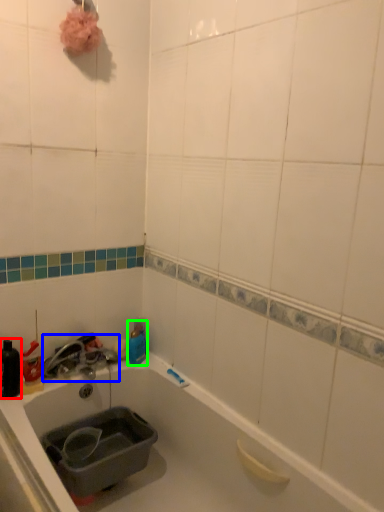
Question: Which is nearer to the bottle (highlighted by a red box)? faucet (highlighted by a blue box) or bottle (highlighted by a green box).

Choices:
 (A) faucet
 (B) bottle

Answer: (A)